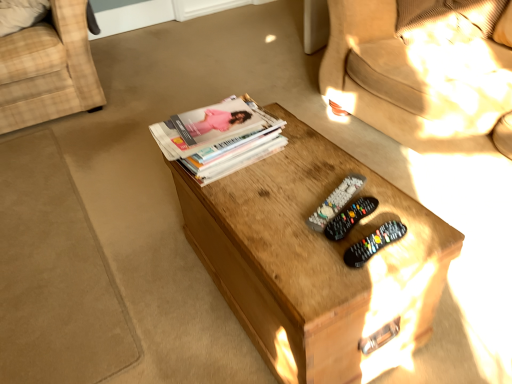
The image size is (512, 384). Find the location of `vacant space in front of white glossy magazine stack at center`. vacant space in front of white glossy magazine stack at center is located at coordinates (253, 189).